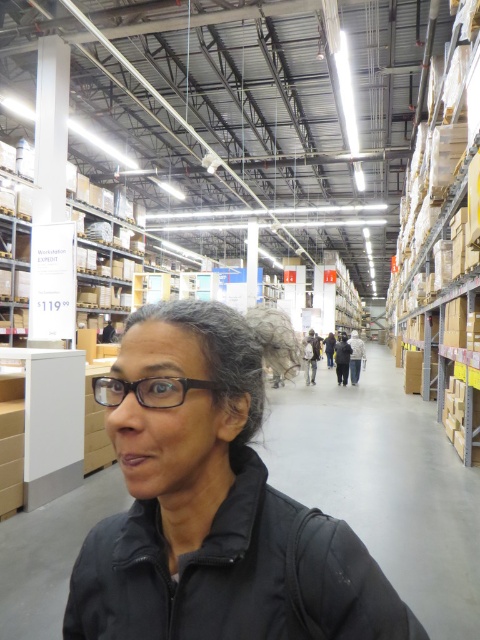
You are a customer in the store and want to take a photo of the gray matte hair at center and the dark gray jacket at center. Can you see both objects clearly in your camera view?

The gray matte hair at center is in front of dark gray jacket at center, so the dark gray jacket at center may be partially obscured. You can see the gray matte hair at center clearly, but only part of the dark gray jacket at center will be visible.

You are an employee at IKEA and need to determine if the black matte jacket at lower left can be placed inside the brown cardboard boxes at right. Based on their thickness, can the jacket fit inside the boxes?

The black matte jacket at lower left is thinner than the brown cardboard boxes at right, so it can fit inside the boxes.